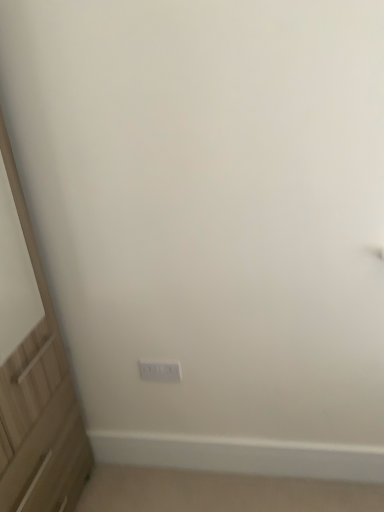
Question: Can you confirm if white plastic electric outlet at center is positioned to the left of light wood screen door at left?

Choices:
 (A) yes
 (B) no

Answer: (B)

Question: Considering the relative positions of white plastic electric outlet at center and light wood screen door at left in the image provided, is white plastic electric outlet at center to the right of light wood screen door at left from the viewer's perspective?

Choices:
 (A) yes
 (B) no

Answer: (A)

Question: Considering the relative sizes of white plastic electric outlet at center and light wood screen door at left in the image provided, is white plastic electric outlet at center bigger than light wood screen door at left?

Choices:
 (A) no
 (B) yes

Answer: (A)

Question: Can you confirm if white plastic electric outlet at center is shorter than light wood screen door at left?

Choices:
 (A) no
 (B) yes

Answer: (B)

Question: Is white plastic electric outlet at center positioned far away from light wood screen door at left?

Choices:
 (A) no
 (B) yes

Answer: (A)

Question: Is the depth of white plastic electric outlet at center greater than that of light wood screen door at left?

Choices:
 (A) yes
 (B) no

Answer: (A)

Question: From the image's perspective, is light wood screen door at left over white plastic electric outlet at center?

Choices:
 (A) yes
 (B) no

Answer: (A)

Question: Is light wood screen door at left outside of white plastic electric outlet at center?

Choices:
 (A) no
 (B) yes

Answer: (B)

Question: Considering the relative sizes of light wood screen door at left and white plastic electric outlet at center in the image provided, is light wood screen door at left shorter than white plastic electric outlet at center?

Choices:
 (A) yes
 (B) no

Answer: (B)

Question: Does light wood screen door at left have a smaller size compared to white plastic electric outlet at center?

Choices:
 (A) no
 (B) yes

Answer: (A)

Question: From the image's perspective, is light wood screen door at left under white plastic electric outlet at center?

Choices:
 (A) yes
 (B) no

Answer: (B)

Question: Is light wood screen door at left at the left side of white plastic electric outlet at center?

Choices:
 (A) no
 (B) yes

Answer: (B)

Question: Looking at the image, does white plastic electric outlet at center seem bigger or smaller compared to light wood screen door at left?

Choices:
 (A) big
 (B) small

Answer: (B)